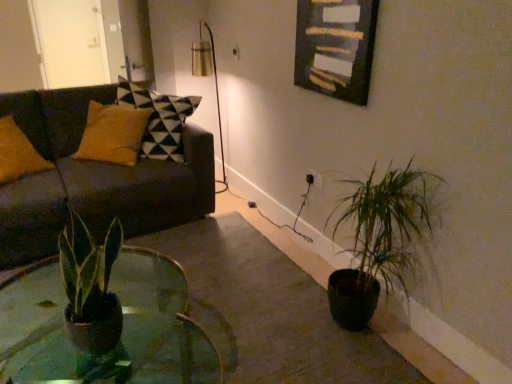
Question: Is green matte plant at lower right taller or shorter than wooden frame at upper center?

Choices:
 (A) tall
 (B) short

Answer: (A)

Question: Relative to wooden frame at upper center, is green matte plant at lower right in front or behind?

Choices:
 (A) behind
 (B) front

Answer: (B)

Question: Based on their relative distances, which object is nearer to the green matte plant at lower right?

Choices:
 (A) wooden frame at upper center
 (B) dark gray fabric couch at left
 (C) white glossy door at upper left
 (D) metallic gold table lamp at upper center
 (E) green glass coffee table at center

Answer: (A)

Question: Estimate the real-world distances between objects in this image. Which object is farther from the green glass coffee table at center?

Choices:
 (A) metallic gold table lamp at upper center
 (B) dark gray fabric couch at left
 (C) green matte plant at lower right
 (D) white glossy door at upper left
 (E) wooden frame at upper center

Answer: (D)